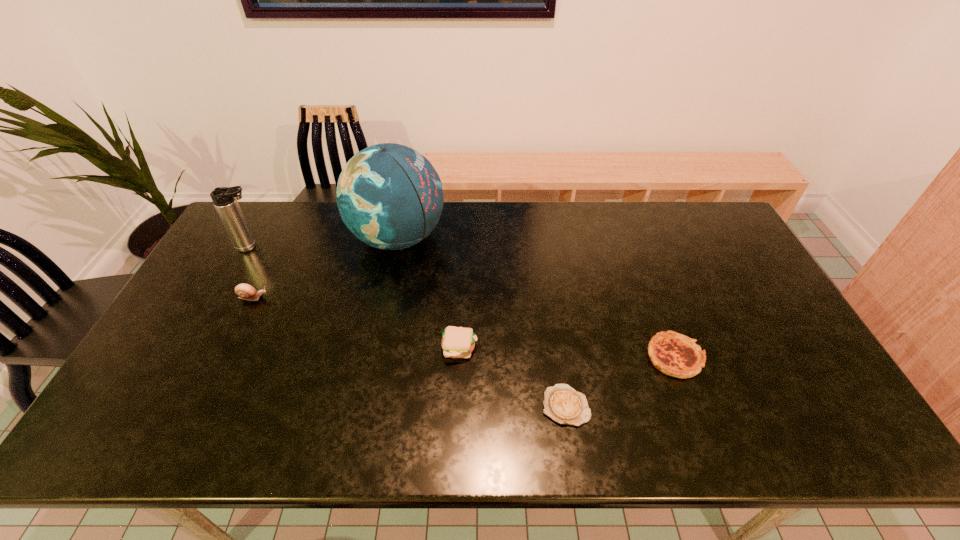
Find the location of a particular element. This screenshot has width=960, height=540. the tallest object is located at coordinates (389, 196).

Find the location of a particular element. The height and width of the screenshot is (540, 960). the fourth object from right to left is located at coordinates (389, 196).

Identify the location of the second tallest object. The image size is (960, 540). click(x=224, y=199).

I want to click on the third farthest object, so (245, 291).

Where is `patty`? The width and height of the screenshot is (960, 540). patty is located at coordinates (457, 342).

Where is `the farther quiche`? the farther quiche is located at coordinates (674, 354).

You are a GUI agent. You are given a task and a screenshot of the screen. Output one action in this format:
    pyautogui.click(x=<x>, y=<y>)
    Task: Click on the rightmost object
    The image size is (960, 540).
    Given the screenshot: What is the action you would take?
    (674, 354)

I want to click on the nearest object, so click(563, 404).

Identify the location of the second object from right to left. (563, 404).

Identify the location of vacant space situated on the right of the tallest object. (481, 238).